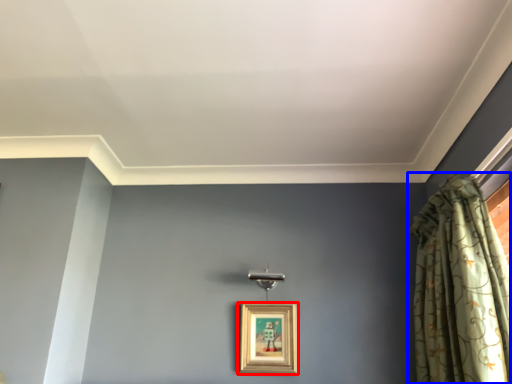
Question: Which point is further to the camera, picture frame (highlighted by a red box) or curtain (highlighted by a blue box)?

Choices:
 (A) picture frame
 (B) curtain

Answer: (A)